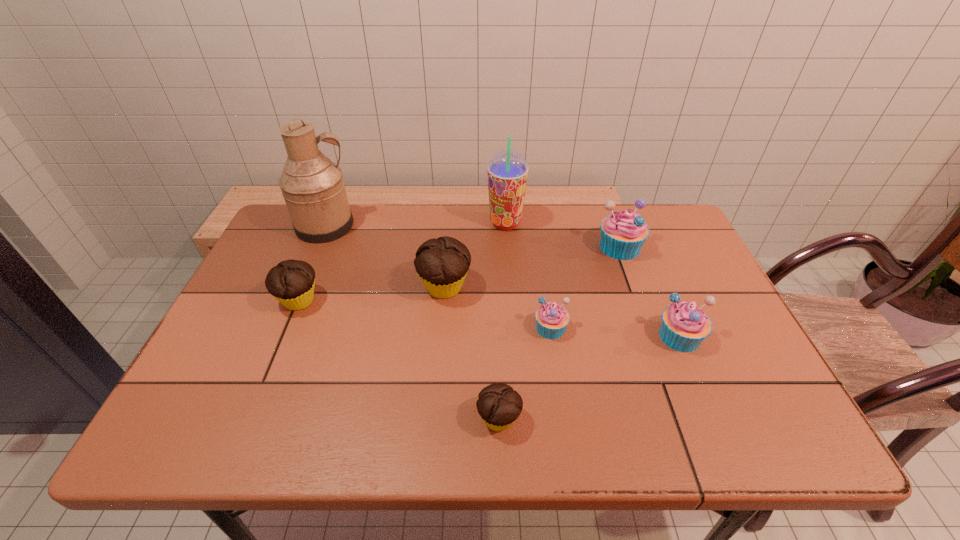
Identify the location of the third muffin from right to left. This screenshot has width=960, height=540. (552, 319).

Locate an element on the screen. the rightmost chocolate muffin is located at coordinates (499, 405).

I want to click on the nearest object, so click(x=499, y=405).

In order to click on vacant area situated 0.060m on the right of the pitcher in this screenshot , I will do `click(374, 226)`.

Where is `vacant space located on the front of the smoothie`? The image size is (960, 540). vacant space located on the front of the smoothie is located at coordinates (513, 321).

In order to click on vacant area situated 0.330m on the front of the biggest blue muffin in this screenshot , I will do click(660, 356).

This screenshot has width=960, height=540. I want to click on blank space located 0.300m on the front of the second muffin from left to right, so click(434, 415).

Find the location of `vacant region located on the back of the second smallest blue muffin`. vacant region located on the back of the second smallest blue muffin is located at coordinates point(655,278).

Image resolution: width=960 pixels, height=540 pixels. I want to click on vacant region located 0.360m on the back of the second biggest chocolate muffin, so click(x=337, y=208).

Find the location of a particular element. blank space located on the back of the leftmost blue muffin is located at coordinates (540, 256).